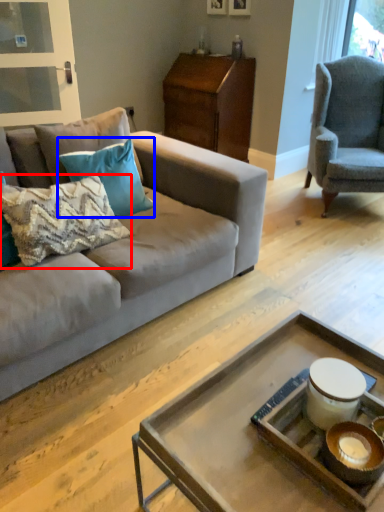
Question: Which point is further to the camera, pillow (highlighted by a red box) or pillow (highlighted by a blue box)?

Choices:
 (A) pillow
 (B) pillow

Answer: (B)